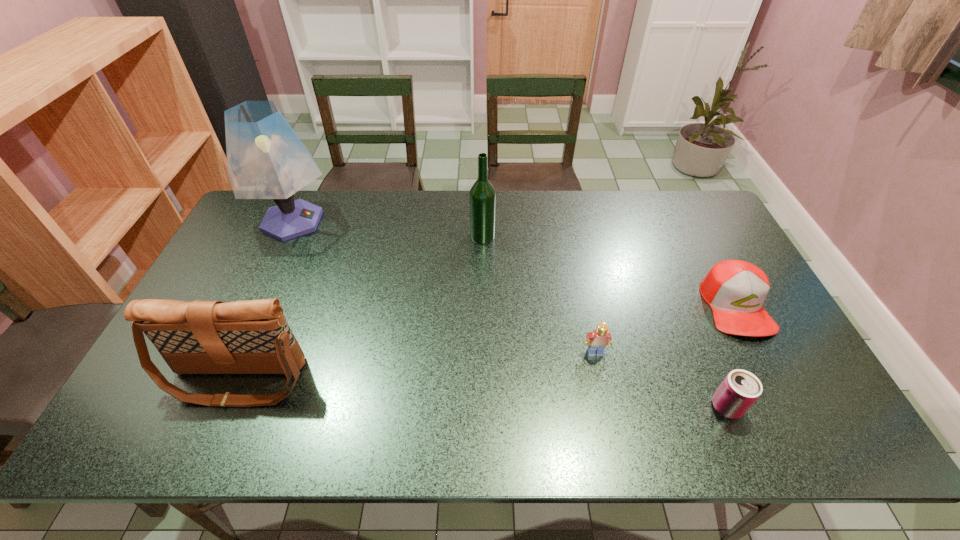
The height and width of the screenshot is (540, 960). In order to click on vacant position located 0.090m on the front-facing side of the shoulder bag in this screenshot , I will do `click(209, 447)`.

Identify the location of free space located 0.200m on the front-facing side of the fourth object from left to right. This screenshot has height=540, width=960. (612, 431).

Find the location of a particular element. Image resolution: width=960 pixels, height=540 pixels. vacant region located on the front-facing side of the third farthest object is located at coordinates (800, 428).

This screenshot has height=540, width=960. In order to click on free spot located on the left of the second object from right to left in this screenshot , I will do `click(651, 407)`.

Locate an element on the screen. The height and width of the screenshot is (540, 960). lampshade that is positioned at the far edge is located at coordinates (266, 159).

Where is `alcohol positioned at the far edge`? Image resolution: width=960 pixels, height=540 pixels. alcohol positioned at the far edge is located at coordinates (482, 197).

You are a GUI agent. You are given a task and a screenshot of the screen. Output one action in this format:
    pyautogui.click(x=<x>, y=<y>)
    Task: Click on the object present at the near edge
    This screenshot has height=540, width=960.
    Given the screenshot: What is the action you would take?
    pyautogui.click(x=740, y=389)

Image resolution: width=960 pixels, height=540 pixels. Identify the location of lampshade that is at the left edge. (266, 159).

Identify the location of shoulder bag located at the left edge. Image resolution: width=960 pixels, height=540 pixels. (199, 337).

The image size is (960, 540). Identify the location of object that is at the right edge. (735, 290).